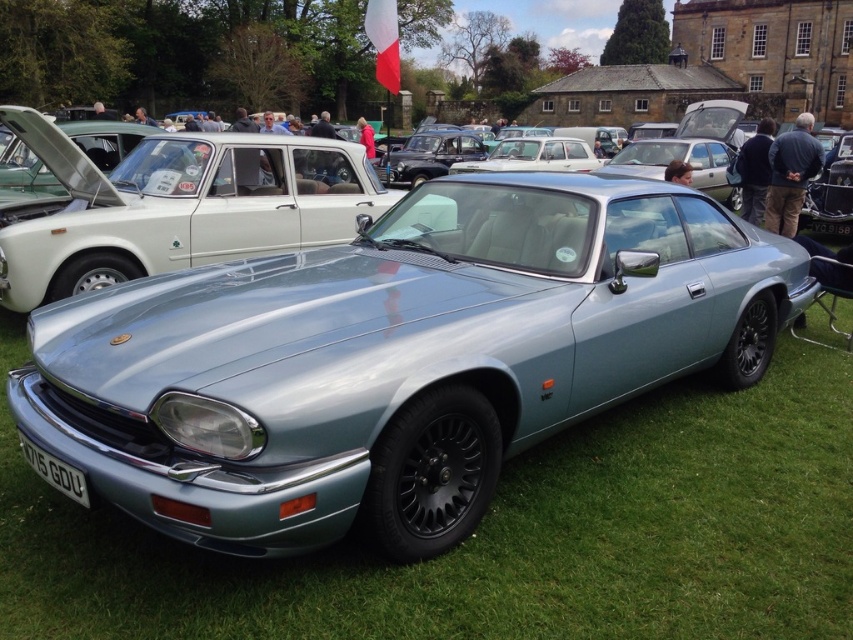
Question: Is satin silver metallic car at center positioned behind white plastic license plate at front?

Choices:
 (A) yes
 (B) no

Answer: (A)

Question: Observing the image, what is the correct spatial positioning of satin silver metallic car at center in reference to white plastic license plate at front?

Choices:
 (A) left
 (B) right

Answer: (A)

Question: Which point appears farthest from the camera in this image?

Choices:
 (A) [x=54, y=467]
 (B) [x=374, y=204]

Answer: (B)

Question: Is satin silver metallic car at center wider than white plastic license plate at front?

Choices:
 (A) yes
 (B) no

Answer: (A)